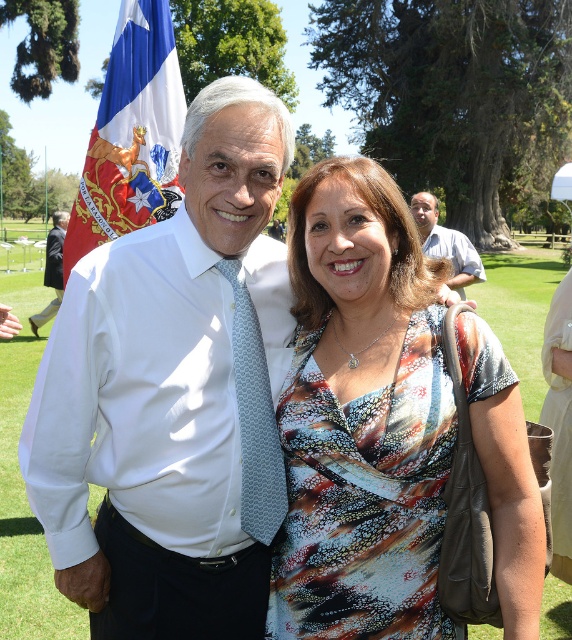
Question: Is printed fabric dress at center bigger than light blue shirt at right?

Choices:
 (A) no
 (B) yes

Answer: (A)

Question: Which point is farther to the camera?

Choices:
 (A) printed fabric dress at center
 (B) blue fabric flag at left
 (C) white smooth shirt at center
 (D) light blue patterned tie at center

Answer: (B)

Question: Which point is closer to the camera?

Choices:
 (A) printed fabric dress at center
 (B) white smooth shirt at center
 (C) light blue shirt at right
 (D) white shirt at center

Answer: (A)

Question: Among these points, which one is nearest to the camera?

Choices:
 (A) (288, 544)
 (B) (133, 148)

Answer: (A)

Question: Is white smooth shirt at center bigger than white shirt at center?

Choices:
 (A) no
 (B) yes

Answer: (A)

Question: Does light blue shirt at right appear over white shirt at center?

Choices:
 (A) yes
 (B) no

Answer: (B)